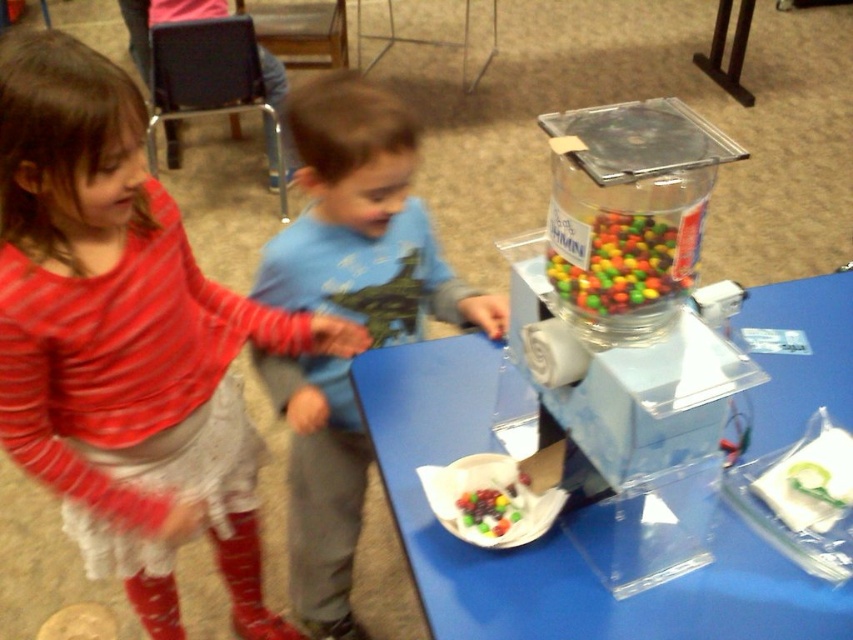
You are a photographer at the party and want to take a photo of the blue plastic table at center without the striped cotton shirt at upper left blocking it. What should you do?

Move the striped cotton shirt at upper left behind the blue plastic table at center or move the blue plastic table at center forward so that the striped cotton shirt at upper left is no longer in front of it.

You are a photographer trying to capture a clear shot of the striped cotton shirt at upper left and the multicolored glossy candy at center. Based on their positions, which object should you focus on first to ensure both are in focus?

The striped cotton shirt at upper left is below the multicolored glossy candy at center, so you should focus on the multicolored glossy candy at center first as it is closer to the camera.

You are a photographer setting up for a children party. You need to place a camera on a stand so that both the striped cotton shirt at upper left and the blue plastic table at center are in frame. Given their heights, which object will require you to adjust the camera angle upwards more?

The striped cotton shirt at upper left is taller than the blue plastic table at center, so you will need to adjust the camera angle upwards more to capture the striped cotton shirt at upper left properly.